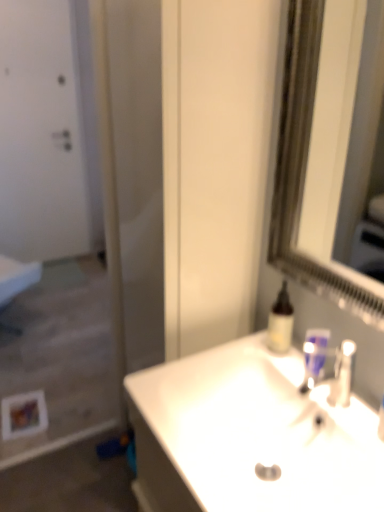
Find the location of `vacant area that is in front of translucent plastic bottle at upper right, acting as the 2th mouthwash starting from the right`. vacant area that is in front of translucent plastic bottle at upper right, acting as the 2th mouthwash starting from the right is located at coordinates (300, 373).